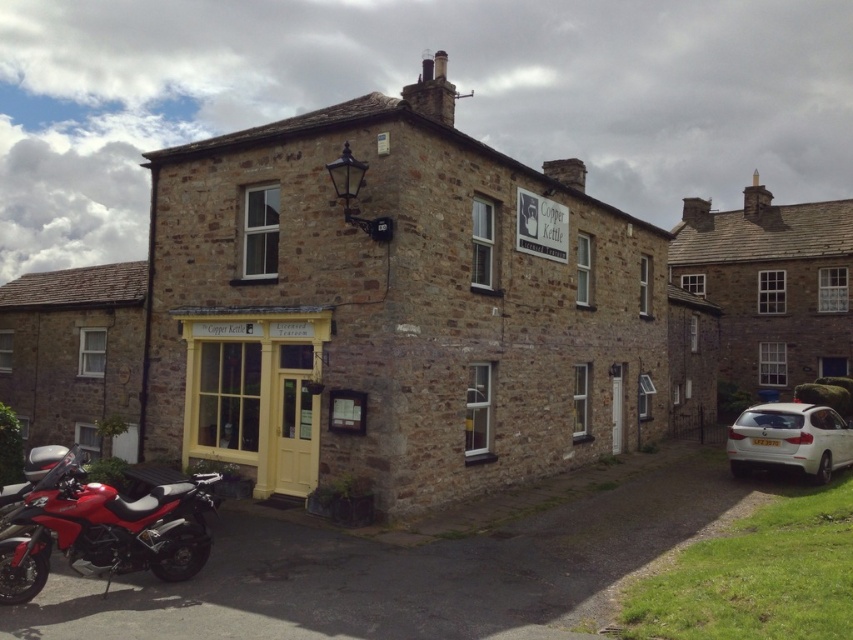
Question: Which point is farther to the camera?

Choices:
 (A) white matte car at lower right
 (B) shiny red motorcycle at lower left

Answer: (A)

Question: Is shiny red motorcycle at lower left smaller than white matte car at lower right?

Choices:
 (A) no
 (B) yes

Answer: (B)

Question: Considering the relative positions of shiny red motorcycle at lower left and white matte car at lower right in the image provided, where is shiny red motorcycle at lower left located with respect to white matte car at lower right?

Choices:
 (A) left
 (B) right

Answer: (A)

Question: From the image, what is the correct spatial relationship of shiny red motorcycle at lower left in relation to white matte car at lower right?

Choices:
 (A) below
 (B) above

Answer: (B)